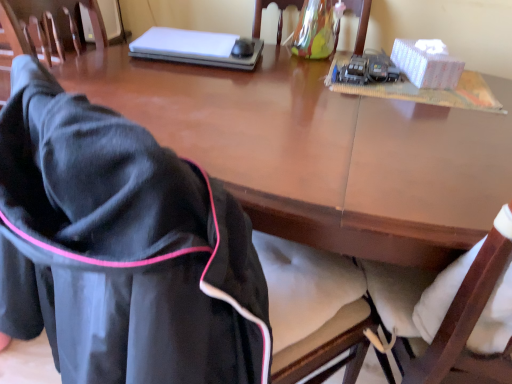
Question: Is point (452, 64) closer or farther from the camera than point (248, 39)?

Choices:
 (A) farther
 (B) closer

Answer: (B)

Question: In the image, is white cardboard box at upper right positioned in front of or behind black plastic mouse at upper center?

Choices:
 (A) front
 (B) behind

Answer: (A)

Question: Which of these objects is positioned farthest from the transparent glass vase at upper center, the first chair viewed from the right?

Choices:
 (A) black fabric jacket at lower left, which appears as the 2th chair when viewed from the right
 (B) black plastic mouse at upper center
 (C) white cardboard box at upper right
 (D) white matte laptop at upper center

Answer: (A)

Question: Which object is positioned closest to the black plastic mouse at upper center?

Choices:
 (A) white cardboard box at upper right
 (B) transparent glass vase at upper center, which is the first chair from top to bottom
 (C) white matte laptop at upper center
 (D) black fabric jacket at lower left, positioned as the 1th chair in front-to-back order

Answer: (C)